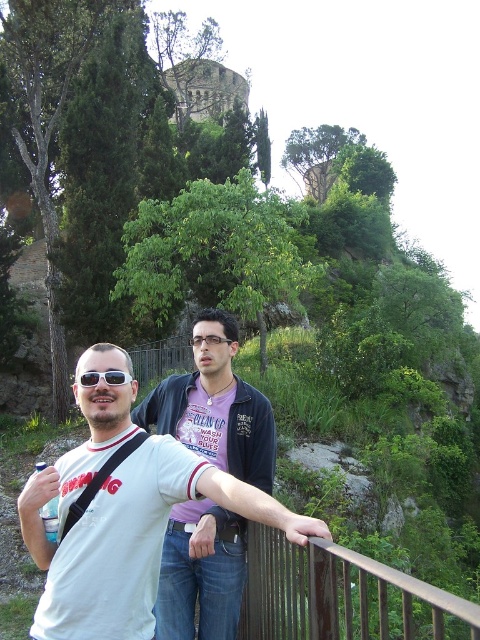
You are standing on the balcony and want to place your sunglasses at center on the rusty metal rail at lower center. Is the rail to the right or left of your sunglasses?

The rusty metal rail at lower center is to the right of sunglasses at center, so the rail is positioned to the right of your sunglasses.

You are designing a new outfit and want to ensure it fits well with the existing elements in the scene. Given the purple cotton shirt at center and the rusty metal rail at lower center, which object has a smaller width?

The purple cotton shirt at center has a smaller width than the rusty metal rail at lower center.

You are a photographer trying to capture a candid shot of the purple cotton shirt at center and the sunglasses at center. Since you want to ensure both are in focus, you need to know which object is taller. Can you tell me which one is taller?

The purple cotton shirt at center is taller than the sunglasses at center, so you should adjust your camera settings to focus on the taller object first.